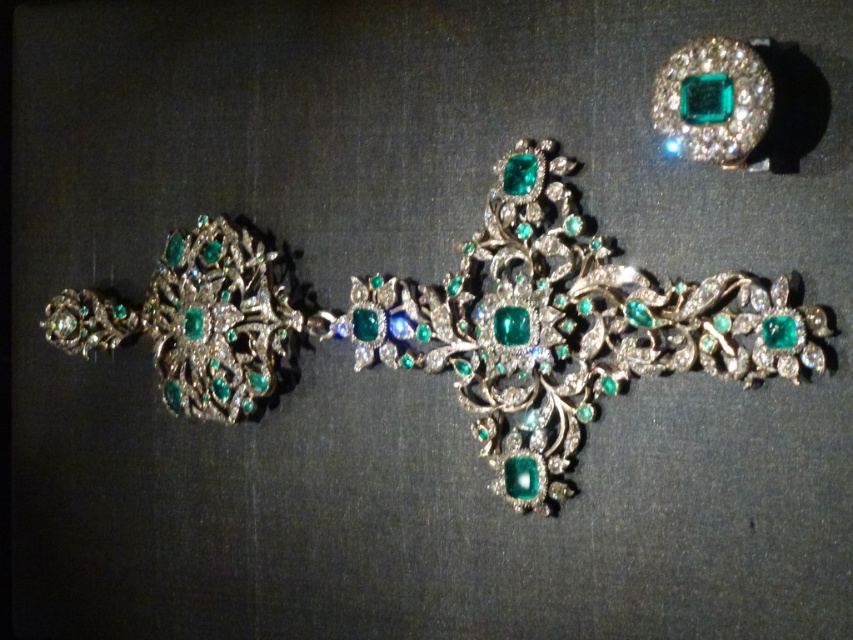
Question: Does matte silver brooch at center-left come behind emerald-cut gemstone at upper right?

Choices:
 (A) yes
 (B) no

Answer: (A)

Question: Is matte silver brooch at center-left to the left of emerald-cut gemstone at upper right from the viewer's perspective?

Choices:
 (A) no
 (B) yes

Answer: (B)

Question: Does matte silver brooch at center-left have a lesser width compared to emerald-cut gemstone at upper right?

Choices:
 (A) yes
 (B) no

Answer: (B)

Question: Which point is farther to the camera?

Choices:
 (A) (531, 141)
 (B) (744, 54)

Answer: (A)